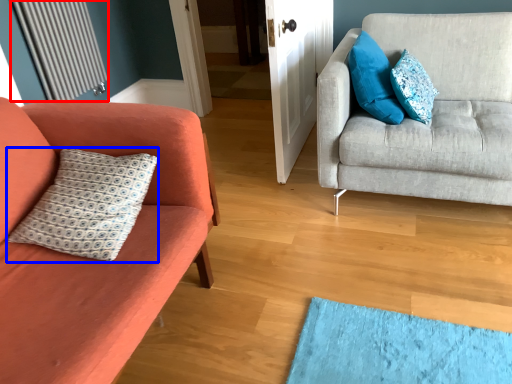
Question: Among these objects, which one is nearest to the camera, radiator (highlighted by a red box) or pillow (highlighted by a blue box)?

Choices:
 (A) radiator
 (B) pillow

Answer: (B)